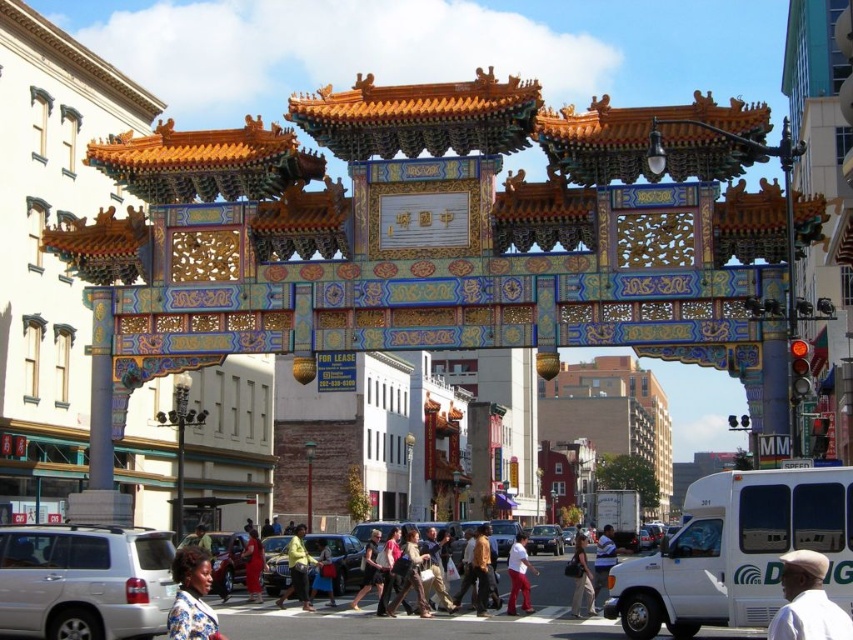
You are a delivery person standing at the blue floral dress at lower left and need to reach the matte black jacket at center to deliver a package. The delivery robot you are using has a maximum range of 20 meters. Can you successfully deliver the package without needing to recharge?

The distance between the blue floral dress at lower left and the matte black jacket at center is 17.05 meters. Since the robot can travel up to 20 meters, you can successfully deliver the package without needing to recharge.

You are a pedestrian standing at the gate and want to cross the street to reach the other side. There is a silver metallic suv at lower left and a metallic silver car at center. Which vehicle is closer to you?

The silver metallic suv at lower left is closer to you as it is 22.79 meters away from the metallic silver car at center, meaning it is nearer to your position at the gate.

You are a delivery driver who needs to park your vehicle. You see a silver metallic suv at lower left and a metallic silver car at center. Which vehicle has a wider body to accommodate your delivery van?

The silver metallic suv at lower left has a wider body than the metallic silver car at center, so it can accommodate your delivery van.